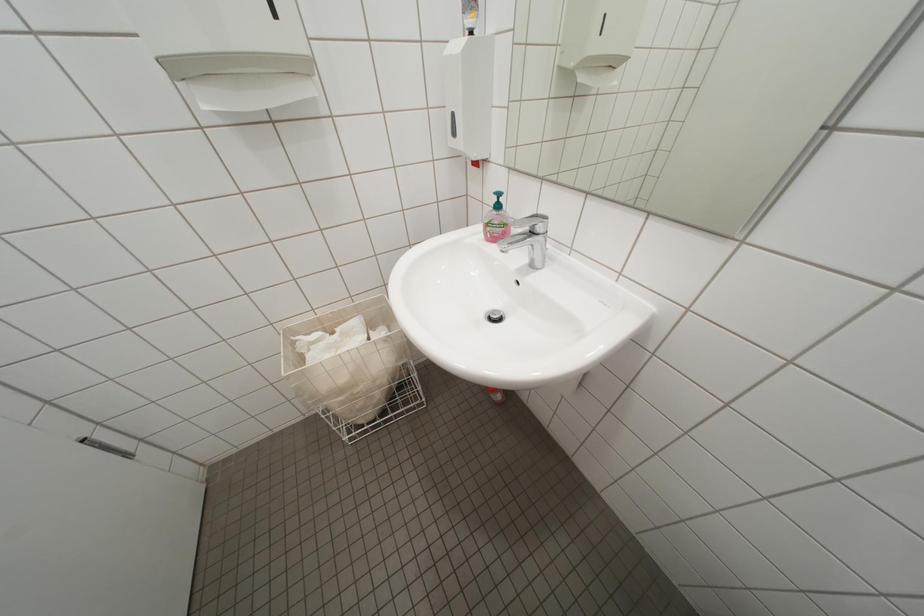
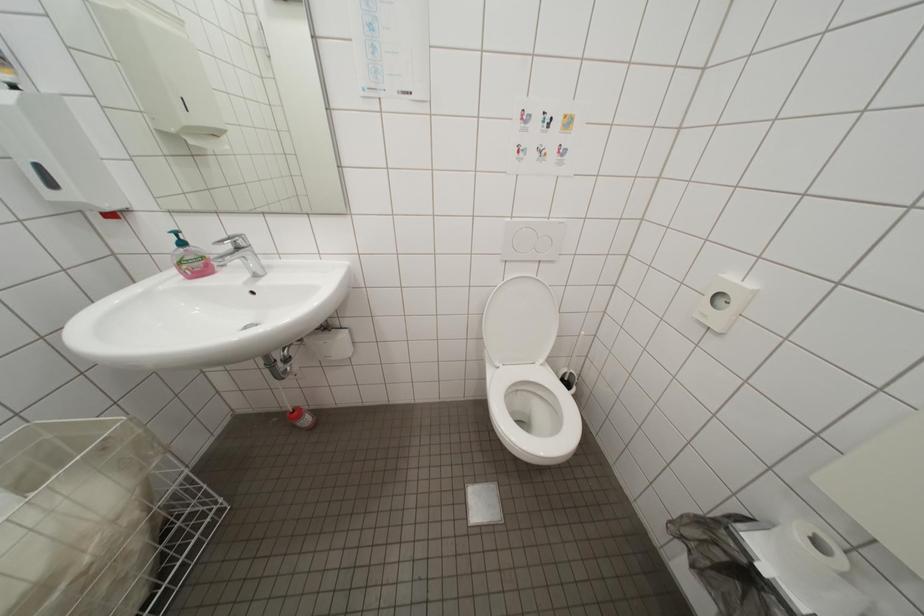
Question: The images are taken continuously from a first-person perspective. In which direction is your viewpoint rotating?

Choices:
 (A) Left
 (B) Right
 (C) Up
 (D) Down

Answer: (B)